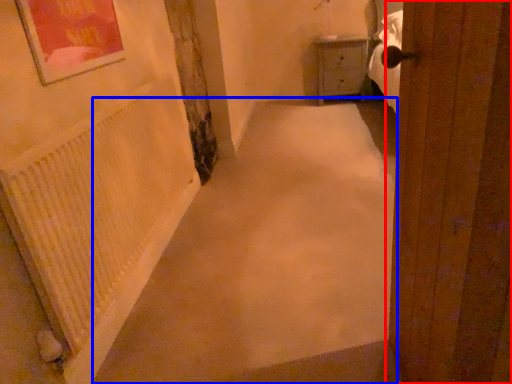
Question: Which object appears closest to the camera in this image, door (highlighted by a red box) or alley (highlighted by a blue box)?

Choices:
 (A) door
 (B) alley

Answer: (A)